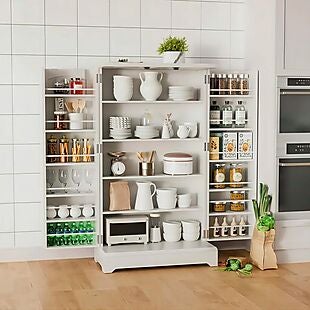
I want to click on handle, so click(163, 74), click(141, 76), click(283, 91), click(286, 162), click(154, 186).